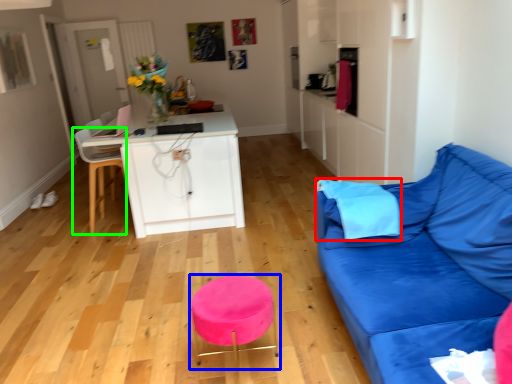
Question: Which object is positioned farthest from pillow (highlighted by a red box)? Select from bar stool (highlighted by a blue box) and chair (highlighted by a green box).

Choices:
 (A) bar stool
 (B) chair

Answer: (B)